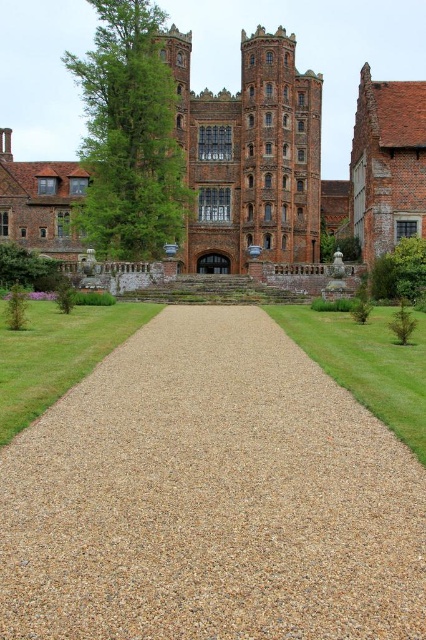
Is brown gravel at center to the left of green grass at lower left from the viewer's perspective?

Incorrect, brown gravel at center is not on the left side of green grass at lower left.

Is brown gravel at center thinner than green grass at lower left?

In fact, brown gravel at center might be wider than green grass at lower left.

Identify the location of brown gravel at center. The width and height of the screenshot is (426, 640). (210, 497).

Does point (77, 189) come farther from viewer compared to point (5, 330)?

Yes, point (77, 189) is farther from viewer.

Who is taller, brown brick castle at center or green grass at lower left?

brown brick castle at center

This screenshot has height=640, width=426. Find the location of `brown brick castle at center`. brown brick castle at center is located at coordinates (293, 161).

Find the location of a particular element. This screenshot has height=640, width=426. brown brick castle at center is located at coordinates (293, 161).

Does brown gravel at center have a larger size compared to brown brick castle at center?

Incorrect, brown gravel at center is not larger than brown brick castle at center.

Is point (268, 474) positioned behind point (357, 93)?

No, (268, 474) is in front of (357, 93).

Locate an element on the screen. brown gravel at center is located at coordinates pos(210,497).